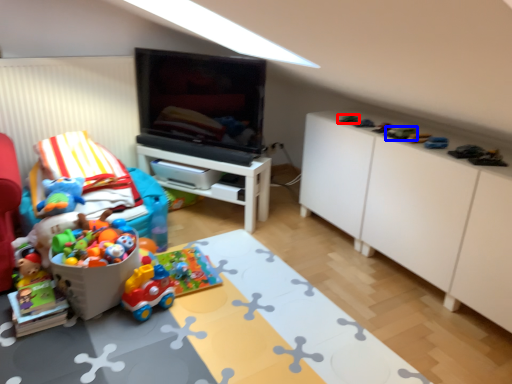
Question: Which object appears farthest to the camera in this image, toy (highlighted by a red box) or toy (highlighted by a blue box)?

Choices:
 (A) toy
 (B) toy

Answer: (A)